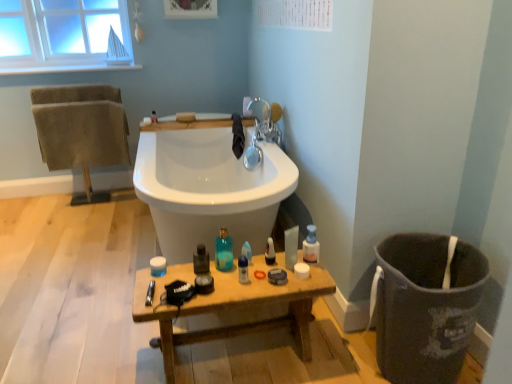
This screenshot has height=384, width=512. I want to click on vacant space that is to the left of blue glossy bottle at center, the 2th mouthwash in the left-to-right sequence, so click(x=198, y=278).